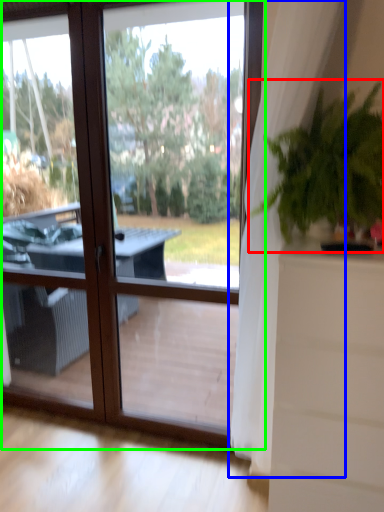
Question: Based on their relative distances, which object is nearer to houseplant (highlighted by a red box)? Choose from curtain (highlighted by a blue box) and window (highlighted by a green box).

Choices:
 (A) curtain
 (B) window

Answer: (A)